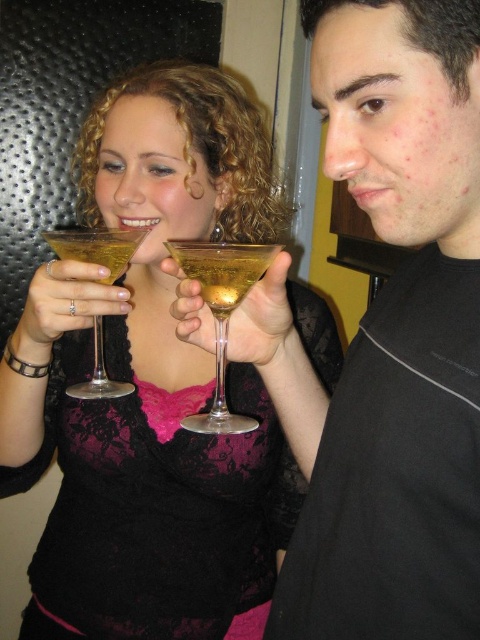
Who is shorter, matte black shirt at right or translucent glass martini at center?

translucent glass martini at center

Does matte black shirt at right have a smaller size compared to translucent glass martini at center?

No.

Where is `matte black shirt at right`? matte black shirt at right is located at coordinates (x=398, y=336).

Does transparent glass at center have a lesser height compared to clear glass martini glass at left?

Incorrect, transparent glass at center's height does not fall short of clear glass martini glass at left's.

Is transparent glass at center positioned before clear glass martini glass at left?

Yes, transparent glass at center is closer to the viewer.

Identify the location of transparent glass at center. The height and width of the screenshot is (640, 480). (222, 310).

At what (x,y) coordinates should I click in order to perform the action: click on transparent glass at center. Please return your answer as a coordinate pair (x, y). Looking at the image, I should click on (222, 310).

From the picture: Is transparent glass at center further to camera compared to translucent glass martini at center?

No, transparent glass at center is closer to the viewer.

Can you confirm if transparent glass at center is positioned to the right of translucent glass martini at center?

Yes, transparent glass at center is to the right of translucent glass martini at center.

This screenshot has width=480, height=640. Identify the location of transparent glass at center. (222, 310).

Where is `transparent glass at center`? The height and width of the screenshot is (640, 480). transparent glass at center is located at coordinates (222, 310).